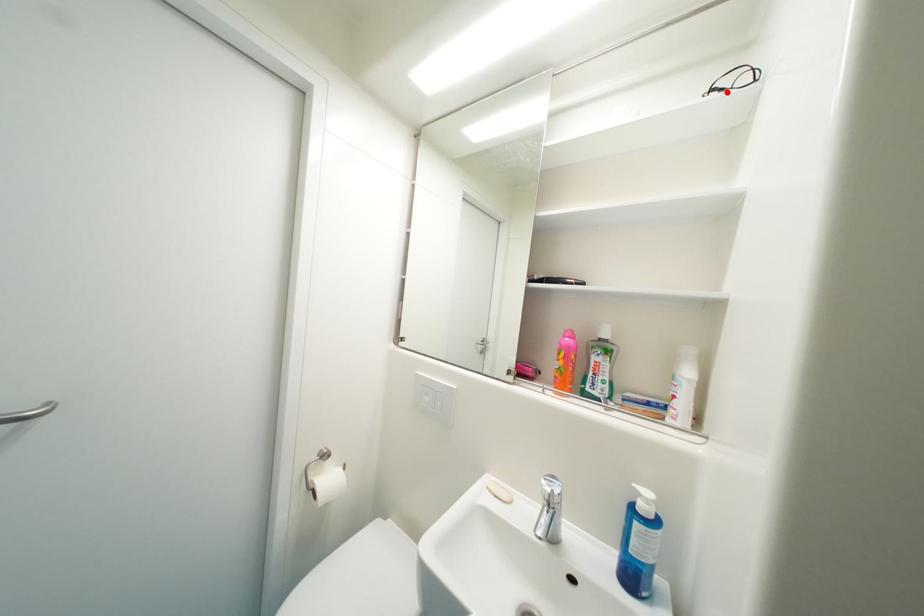
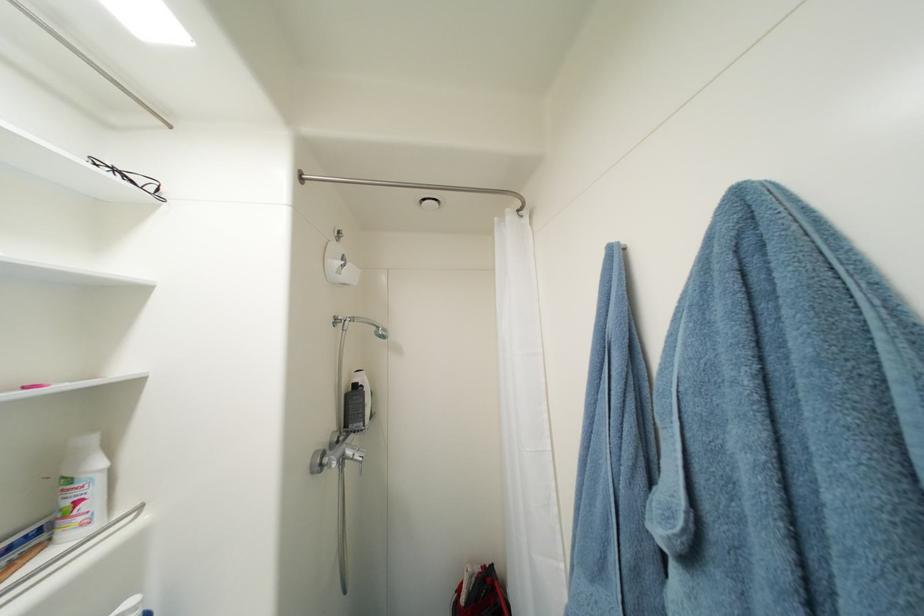
The point at the highlighted location is marked in the first image. Where is the corresponding point in the second image?

(140, 184)